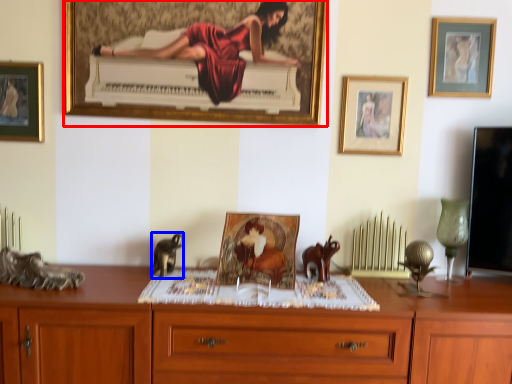
Question: Among these objects, which one is nearest to the camera, picture frame (highlighted by a red box) or animal (highlighted by a blue box)?

Choices:
 (A) picture frame
 (B) animal

Answer: (B)